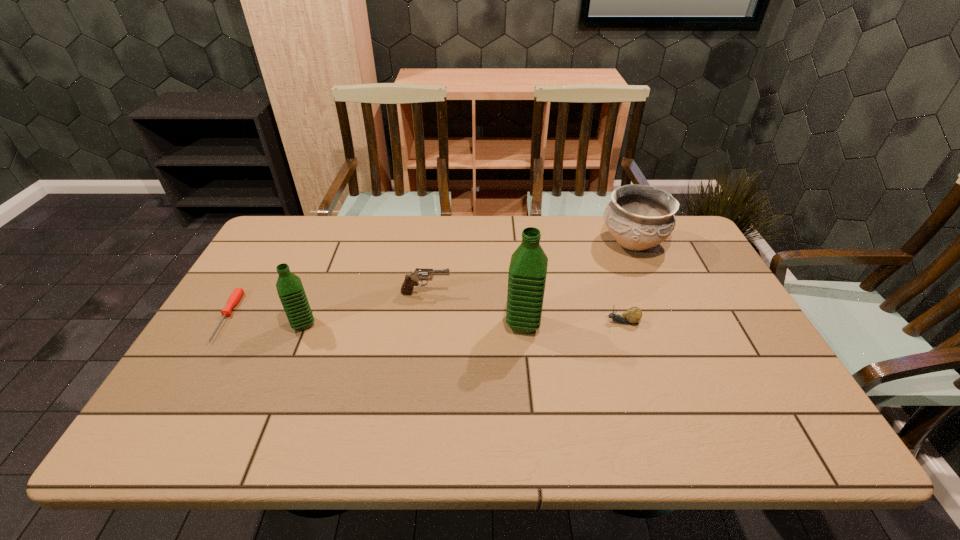
The image size is (960, 540). What are the coordinates of `empty location between the fourth shortest object and the shorter water bottle` in the screenshot? It's located at (468, 284).

Where is `vacant region between the escargot and the leftmost object`? vacant region between the escargot and the leftmost object is located at coordinates (424, 319).

Find the location of `vacant area that lies between the shortest object and the third object from right to left`. vacant area that lies between the shortest object and the third object from right to left is located at coordinates (375, 320).

Identify the location of empty location between the taller water bottle and the fifth tallest object. The width and height of the screenshot is (960, 540). (573, 323).

You are a GUI agent. You are given a task and a screenshot of the screen. Output one action in this format:
    pyautogui.click(x=<x>, y=<y>)
    Task: Click on the vacant area between the tallest object and the second shortest object
    The width and height of the screenshot is (960, 540).
    Given the screenshot: What is the action you would take?
    pyautogui.click(x=573, y=323)

What are the coordinates of `the second closest object to the third shortest object` in the screenshot? It's located at (289, 286).

Identify which object is located as the fifth nearest to the third object from left to right. Please provide its 2D coordinates. Your answer should be formatted as a tuple, i.e. [(x, y)], where the tuple contains the x and y coordinates of a point satisfying the conditions above.

[(639, 217)]

Where is `free space that satisfies the following two spatial constraints: 1. at the barrel of the third shortest object; 2. at the tip of the screwdriver`? This screenshot has width=960, height=540. free space that satisfies the following two spatial constraints: 1. at the barrel of the third shortest object; 2. at the tip of the screwdriver is located at coordinates (423, 316).

Locate an element on the screen. vacant point that satisfies the following two spatial constraints: 1. on the back side of the third object from right to left; 2. on the right side of the farthest object is located at coordinates (516, 243).

Image resolution: width=960 pixels, height=540 pixels. I want to click on vacant space that satisfies the following two spatial constraints: 1. at the barrel of the third shortest object; 2. at the tip of the screwdriver, so click(x=423, y=316).